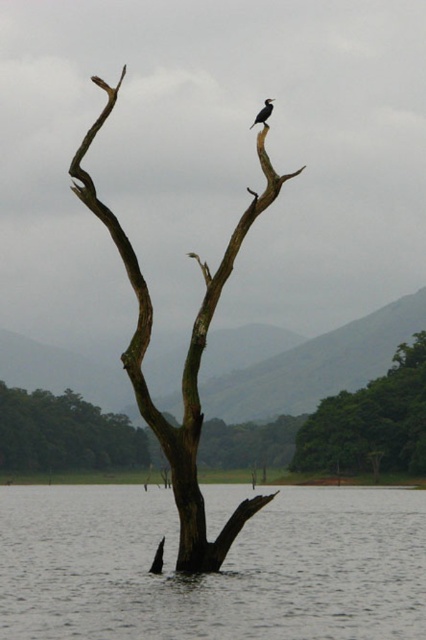
You are a birdwatcher observing the scene from the lakeside. You see the brown rough branch at center and the dark gray feathers at upper center. Which object is positioned higher in the image?

The brown rough branch at center is much taller than the dark gray feathers at upper center, so the brown rough branch at center is positioned higher in the image.

You are a small boat trying to navigate between the transparent water at tree center and the brown rough branch at center. Can you pass through the space between them?

The transparent water at tree center is wider than the brown rough branch at center, so yes, the boat can pass through the space between them since the water is wider than the branch.